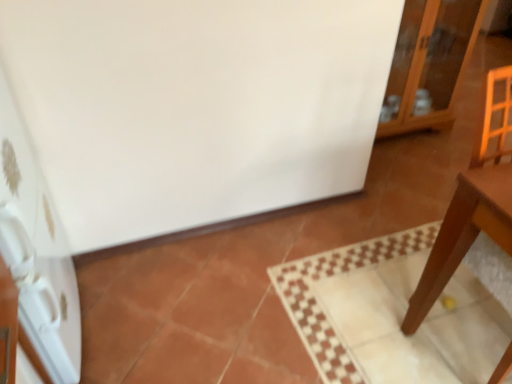
Question: Does white glossy refrigerator at left have a greater width compared to glossy wood cabinet at upper right?

Choices:
 (A) no
 (B) yes

Answer: (A)

Question: Is white glossy refrigerator at left beside glossy wood cabinet at upper right?

Choices:
 (A) no
 (B) yes

Answer: (A)

Question: Does white glossy refrigerator at left have a lesser height compared to glossy wood cabinet at upper right?

Choices:
 (A) no
 (B) yes

Answer: (A)

Question: Does white glossy refrigerator at left come behind glossy wood cabinet at upper right?

Choices:
 (A) yes
 (B) no

Answer: (B)

Question: Is there a large distance between white glossy refrigerator at left and glossy wood cabinet at upper right?

Choices:
 (A) no
 (B) yes

Answer: (B)

Question: Is white glossy refrigerator at left taller than glossy wood cabinet at upper right?

Choices:
 (A) no
 (B) yes

Answer: (B)

Question: Is glossy wood cabinet at upper right far from white glossy refrigerator at left?

Choices:
 (A) no
 (B) yes

Answer: (B)

Question: Is the position of glossy wood cabinet at upper right less distant than that of white glossy refrigerator at left?

Choices:
 (A) yes
 (B) no

Answer: (B)

Question: Can you confirm if glossy wood cabinet at upper right is shorter than white glossy refrigerator at left?

Choices:
 (A) yes
 (B) no

Answer: (A)

Question: Is glossy wood cabinet at upper right at the left side of white glossy refrigerator at left?

Choices:
 (A) no
 (B) yes

Answer: (A)

Question: From the image's perspective, is glossy wood cabinet at upper right under white glossy refrigerator at left?

Choices:
 (A) yes
 (B) no

Answer: (B)

Question: Considering the relative sizes of glossy wood cabinet at upper right and white glossy refrigerator at left in the image provided, is glossy wood cabinet at upper right taller than white glossy refrigerator at left?

Choices:
 (A) no
 (B) yes

Answer: (A)

Question: From the image's perspective, is white glossy refrigerator at left positioned above or below glossy wood cabinet at upper right?

Choices:
 (A) above
 (B) below

Answer: (B)